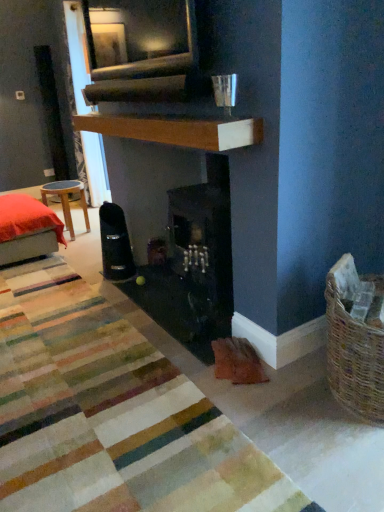
Question: Is velvet red cushion at left not close to striped wool rug at center?

Choices:
 (A) no
 (B) yes

Answer: (B)

Question: From the image's perspective, would you say velvet red cushion at left is positioned over striped wool rug at center?

Choices:
 (A) yes
 (B) no

Answer: (A)

Question: Is velvet red cushion at left next to striped wool rug at center and touching it?

Choices:
 (A) yes
 (B) no

Answer: (B)

Question: Is velvet red cushion at left behind striped wool rug at center?

Choices:
 (A) no
 (B) yes

Answer: (B)

Question: Can you confirm if velvet red cushion at left is wider than striped wool rug at center?

Choices:
 (A) yes
 (B) no

Answer: (B)

Question: Is velvet red cushion at left oriented towards striped wool rug at center?

Choices:
 (A) yes
 (B) no

Answer: (A)

Question: Are white textured curtain at upper left and velvet red cushion at left located far from each other?

Choices:
 (A) yes
 (B) no

Answer: (B)

Question: Is white textured curtain at upper left placed right next to velvet red cushion at left?

Choices:
 (A) yes
 (B) no

Answer: (B)

Question: Is white textured curtain at upper left to the left of velvet red cushion at left from the viewer's perspective?

Choices:
 (A) no
 (B) yes

Answer: (A)

Question: Would you say velvet red cushion at left is part of white textured curtain at upper left's contents?

Choices:
 (A) no
 (B) yes

Answer: (A)

Question: Is white textured curtain at upper left closer to the viewer compared to velvet red cushion at left?

Choices:
 (A) yes
 (B) no

Answer: (B)

Question: Is white textured curtain at upper left shorter than velvet red cushion at left?

Choices:
 (A) yes
 (B) no

Answer: (B)

Question: Is velvet red cushion at left beside white textured curtain at upper left?

Choices:
 (A) yes
 (B) no

Answer: (B)